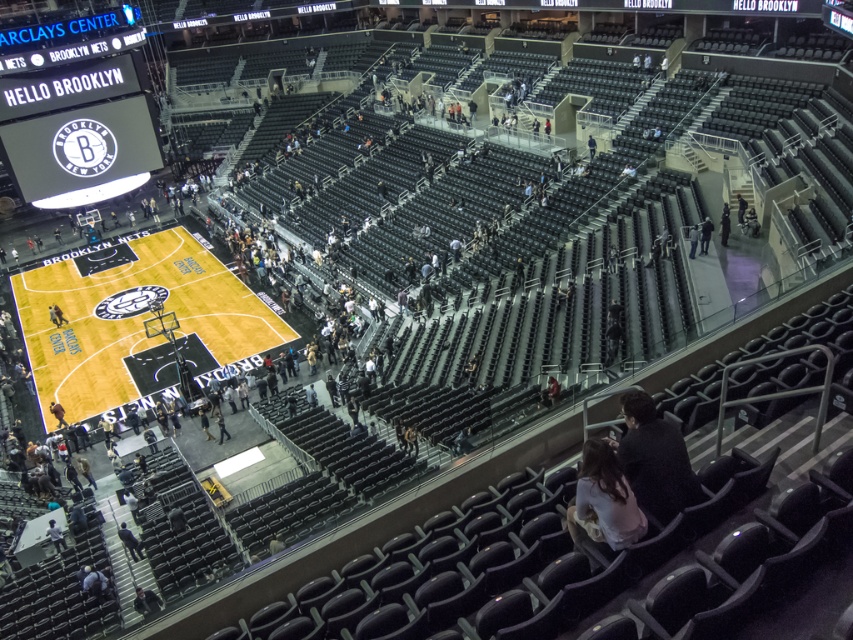
Question: Can you confirm if dark gray sweater at center is positioned to the left of white fabric at lower right?

Choices:
 (A) yes
 (B) no

Answer: (B)

Question: Based on their relative distances, which object is farther from the dark gray sweater at center?

Choices:
 (A) white fabric at lower right
 (B) yellow polished wood basketball court at center
 (C) dark gray jacket at center
 (D) white glossy scoreboard at upper left

Answer: (D)

Question: Considering the real-world distances, which object is farthest from the yellow polished wood basketball court at center?

Choices:
 (A) white fabric at lower right
 (B) dark gray jacket at center

Answer: (A)

Question: Can you confirm if white fabric at lower right is bigger than dark gray jacket at center?

Choices:
 (A) yes
 (B) no

Answer: (A)

Question: Which object is farther from the camera taking this photo?

Choices:
 (A) dark gray sweater at center
 (B) dark gray fabric jacket at lower left
 (C) dark gray jacket at center

Answer: (C)

Question: Is white fabric at lower right above dark gray jacket at center?

Choices:
 (A) no
 (B) yes

Answer: (A)